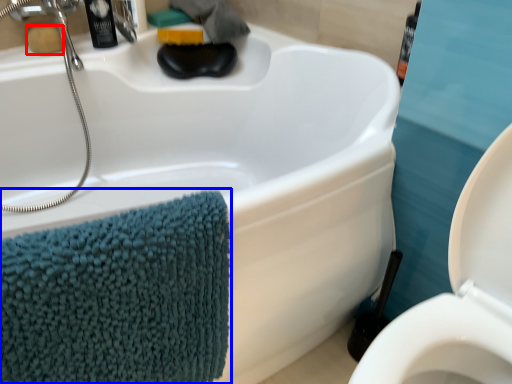
Question: Which point is further to the camera, soap (highlighted by a red box) or bath towel (highlighted by a blue box)?

Choices:
 (A) soap
 (B) bath towel

Answer: (A)